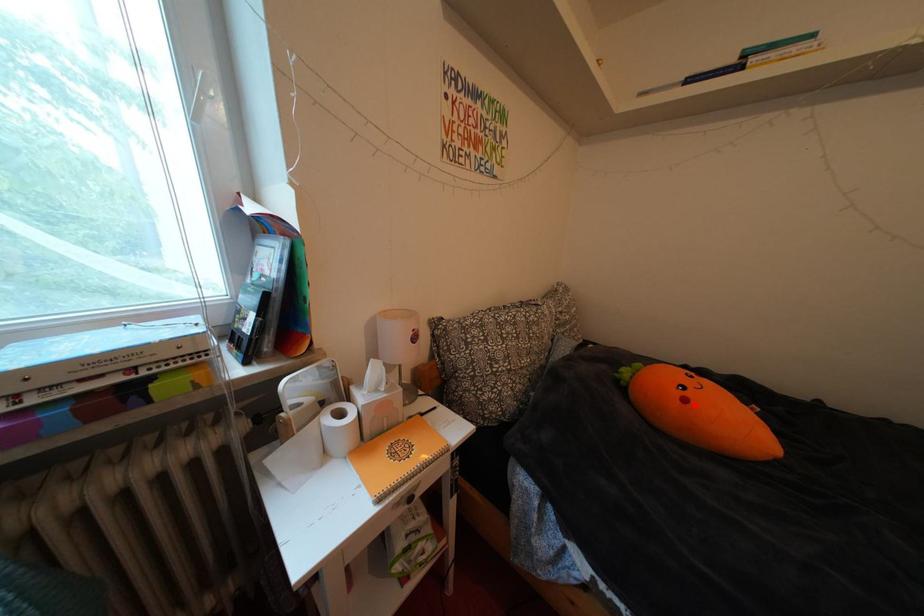
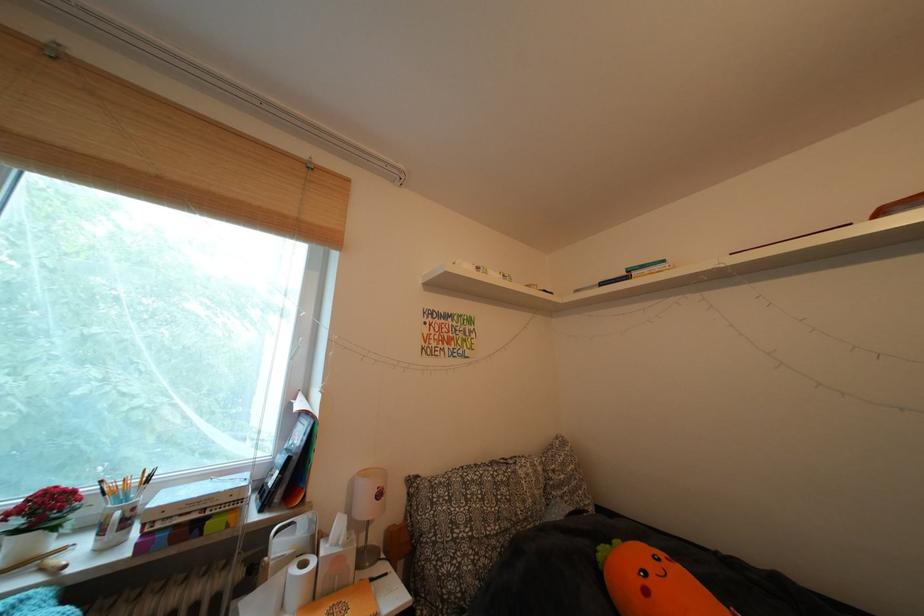
Locate, in the second image, the point that corresponds to the highlighted location in the first image.

(657, 597)